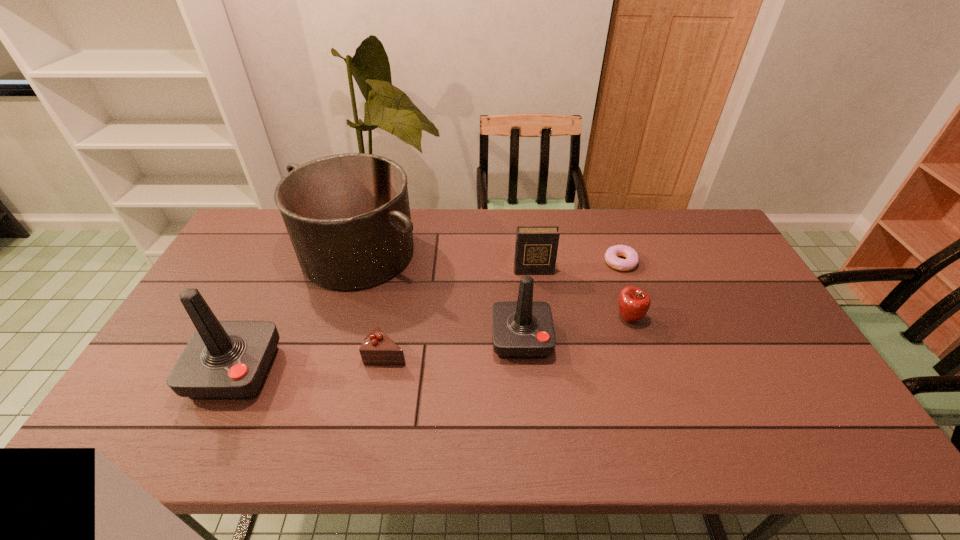
Locate an element on the screen. The height and width of the screenshot is (540, 960). free space at the near edge of the desktop is located at coordinates 762,406.

Find the location of a particular element. The height and width of the screenshot is (540, 960). free space at the left edge is located at coordinates (208, 291).

In the image, there is a desktop. At what (x,y) coordinates should I click in order to perform the action: click on vacant space at the near right corner. Please return your answer as a coordinate pair (x, y). The height and width of the screenshot is (540, 960). Looking at the image, I should click on (809, 380).

Where is `free space between the chocolate cake and the third tallest object`? The height and width of the screenshot is (540, 960). free space between the chocolate cake and the third tallest object is located at coordinates (454, 346).

What are the coordinates of `vacant space in between the left joystick and the fourth tallest object` in the screenshot? It's located at (385, 321).

Image resolution: width=960 pixels, height=540 pixels. In order to click on unoccupied area between the pan and the second shortest object in this screenshot , I will do `click(372, 303)`.

The height and width of the screenshot is (540, 960). In order to click on vacant point located between the fourth shortest object and the shortest object in this screenshot , I will do `click(577, 267)`.

At what (x,y) coordinates should I click in order to perform the action: click on vacant space that is in between the pan and the second shortest object. Please return your answer as a coordinate pair (x, y). Image resolution: width=960 pixels, height=540 pixels. Looking at the image, I should click on (372, 303).

Locate an element on the screen. Image resolution: width=960 pixels, height=540 pixels. unoccupied position between the left joystick and the pan is located at coordinates (297, 312).

Find the location of a particular element. This screenshot has width=960, height=540. vacant space in between the diary and the apple is located at coordinates point(581,295).